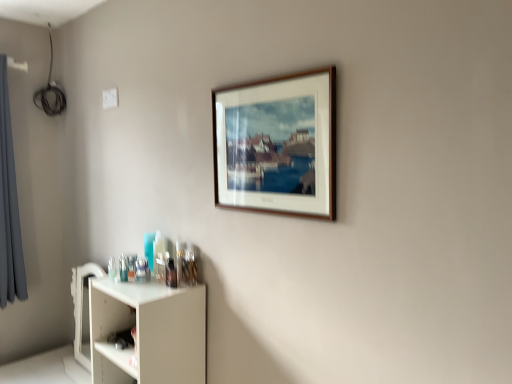
Question: Considering the relative sizes of white matte shelf at lower left and wooden picture frame at upper center in the image provided, is white matte shelf at lower left smaller than wooden picture frame at upper center?

Choices:
 (A) yes
 (B) no

Answer: (B)

Question: Is white matte shelf at lower left oriented towards wooden picture frame at upper center?

Choices:
 (A) yes
 (B) no

Answer: (B)

Question: Is white matte shelf at lower left outside of wooden picture frame at upper center?

Choices:
 (A) yes
 (B) no

Answer: (A)

Question: Is white matte shelf at lower left wider than wooden picture frame at upper center?

Choices:
 (A) yes
 (B) no

Answer: (A)

Question: Is white matte shelf at lower left looking in the opposite direction of wooden picture frame at upper center?

Choices:
 (A) no
 (B) yes

Answer: (A)

Question: From the image's perspective, is gray fabric curtain at left positioned above or below wooden picture frame at upper center?

Choices:
 (A) above
 (B) below

Answer: (B)

Question: Looking at the image, does gray fabric curtain at left seem bigger or smaller compared to wooden picture frame at upper center?

Choices:
 (A) big
 (B) small

Answer: (A)

Question: Relative to wooden picture frame at upper center, is gray fabric curtain at left in front or behind?

Choices:
 (A) front
 (B) behind

Answer: (B)

Question: Is gray fabric curtain at left spatially inside wooden picture frame at upper center, or outside of it?

Choices:
 (A) outside
 (B) inside

Answer: (A)

Question: Based on their sizes in the image, would you say gray fabric curtain at left is bigger or smaller than white matte shelf at lower left?

Choices:
 (A) small
 (B) big

Answer: (A)

Question: Does point (15, 289) appear closer or farther from the camera than point (166, 334)?

Choices:
 (A) closer
 (B) farther

Answer: (B)

Question: Looking at their shapes, would you say gray fabric curtain at left is wider or thinner than white matte shelf at lower left?

Choices:
 (A) wide
 (B) thin

Answer: (B)

Question: Is gray fabric curtain at left situated inside white matte shelf at lower left or outside?

Choices:
 (A) outside
 (B) inside

Answer: (A)

Question: Based on their positions, is white matte shelf at lower left located to the left or right of wooden picture frame at upper center?

Choices:
 (A) left
 (B) right

Answer: (A)

Question: Based on their sizes in the image, would you say white matte shelf at lower left is bigger or smaller than wooden picture frame at upper center?

Choices:
 (A) big
 (B) small

Answer: (A)